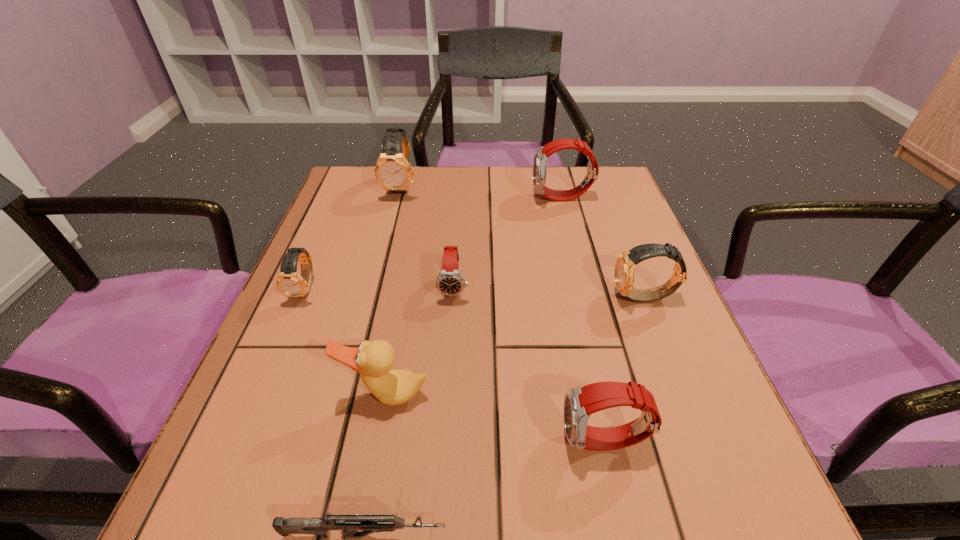
Identify which red watch is the second closest to the farthest red watch. Please provide its 2D coordinates. Your answer should be formatted as a tuple, i.e. [(x, y)], where the tuple contains the x and y coordinates of a point satisfying the conditions above.

[(580, 402)]

At what (x,y) coordinates should I click in order to perform the action: click on the second closest red watch to the third watch from left to right. Please return your answer as a coordinate pair (x, y). The image size is (960, 540). Looking at the image, I should click on (540, 158).

Locate an element on the screen. free spot that satisfies the following two spatial constraints: 1. on the face of the farthest red watch; 2. on the face of the smallest gold watch is located at coordinates (586, 289).